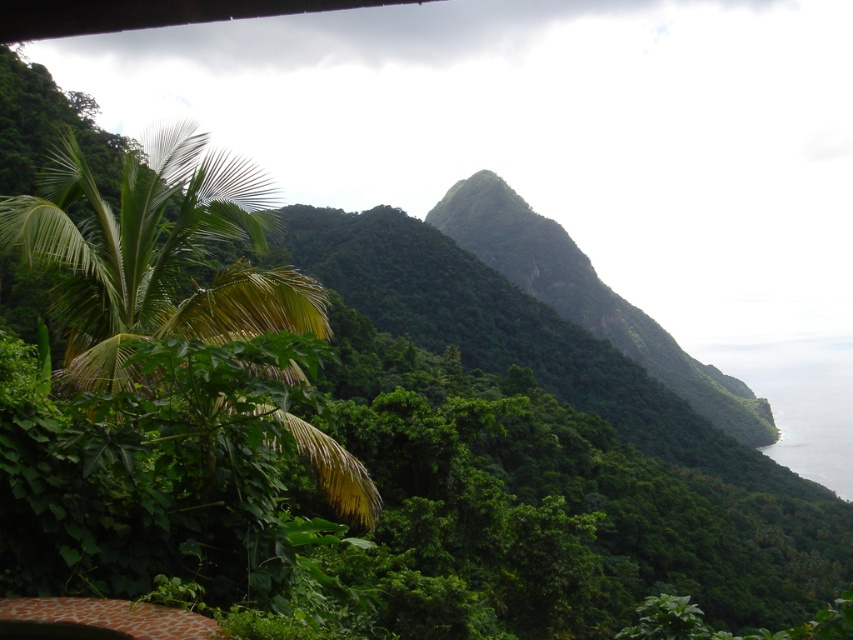
You are a hiker who wants to cross the clear water at lower right to reach the green leafy hill at center. Is the hill to your left or right when facing the water?

The green leafy hill at center is positioned on the left side of clear water at lower right, so when facing the water, the hill is to your left.

Based on the scene description, what is the 2D coordinate of the green leafy hill at center?

The green leafy hill at center is located at the 2D coordinate point of (589, 298).

You are a hiker standing at the starting point of the trail. You see the green leafy hill at center and the clear water at lower right. Which one is nearer to you?

The green leafy hill at center is closer to you than the clear water at lower right.